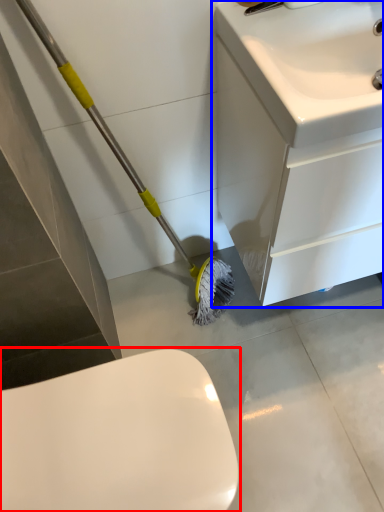
Question: Which of the following is the farthest to the observer, toilet (highlighted by a red box) or bathroom cabinet (highlighted by a blue box)?

Choices:
 (A) toilet
 (B) bathroom cabinet

Answer: (B)